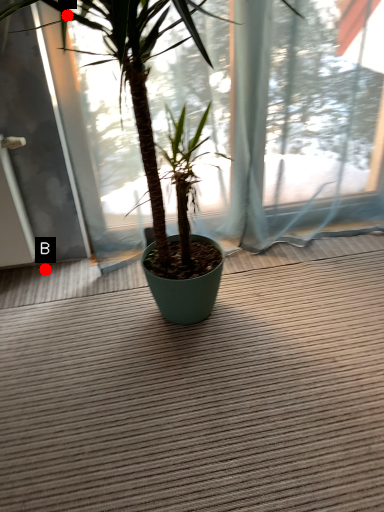
Question: Two points are circled on the image, labeled by A and B beside each circle. Which point is further to the camera?

Choices:
 (A) A is further
 (B) B is further

Answer: (B)